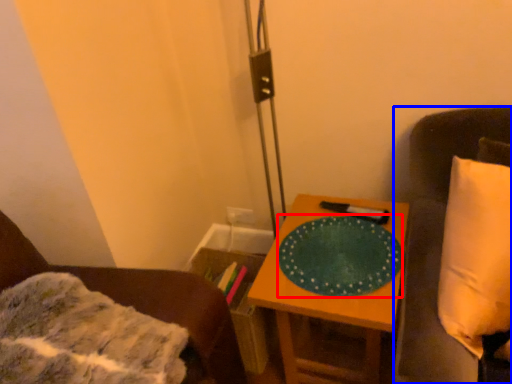
Question: Which point is closer to the camera, platter (highlighted by a red box) or furniture (highlighted by a blue box)?

Choices:
 (A) platter
 (B) furniture

Answer: (B)